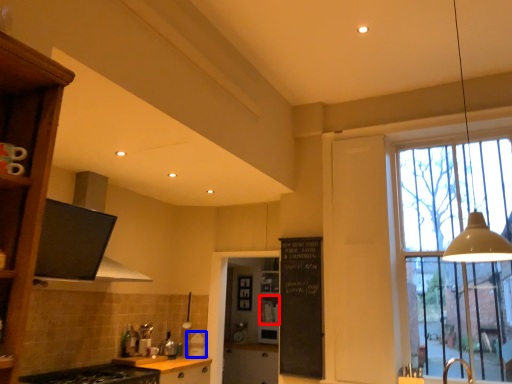
Question: Which object is further to the camera taking this photo, shelf (highlighted by a red box) or appliance (highlighted by a blue box)?

Choices:
 (A) shelf
 (B) appliance

Answer: (A)